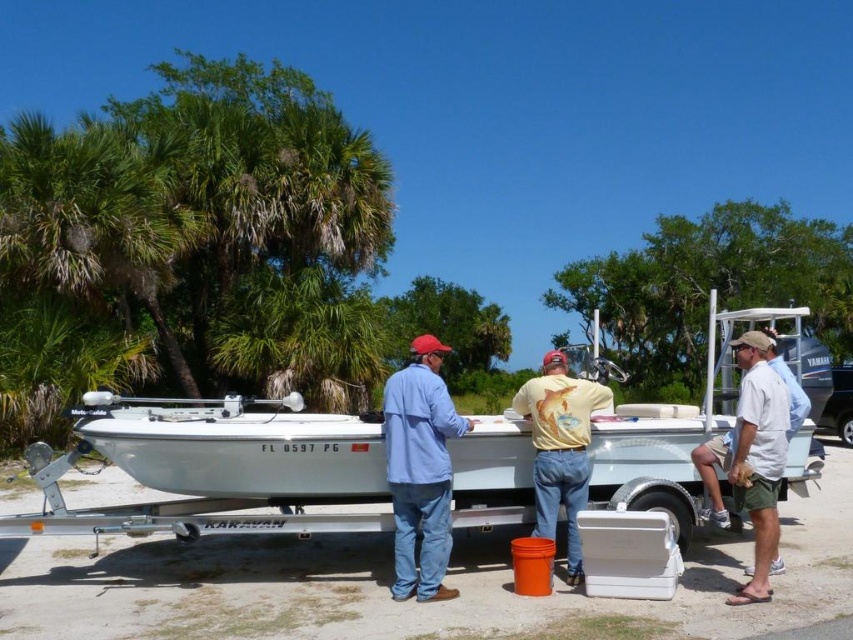
Question: Which of these objects is positioned farthest from the yellow t-shirt at center?

Choices:
 (A) blue cotton shirt at center
 (B) white cotton shirt at right

Answer: (B)

Question: Does blue cotton shirt at center appear over white cotton shirt at right?

Choices:
 (A) yes
 (B) no

Answer: (B)

Question: Does blue cotton shirt at center appear on the left side of yellow t-shirt at center?

Choices:
 (A) yes
 (B) no

Answer: (A)

Question: Which of these objects is positioned closest to the yellow t-shirt at center?

Choices:
 (A) blue cotton shirt at center
 (B) white cotton shirt at right

Answer: (A)

Question: Does white cotton shirt at right appear on the left side of yellow t-shirt at center?

Choices:
 (A) yes
 (B) no

Answer: (B)

Question: Which object is closer to the camera taking this photo?

Choices:
 (A) white cotton shirt at right
 (B) yellow t-shirt at center
 (C) blue cotton shirt at center

Answer: (A)